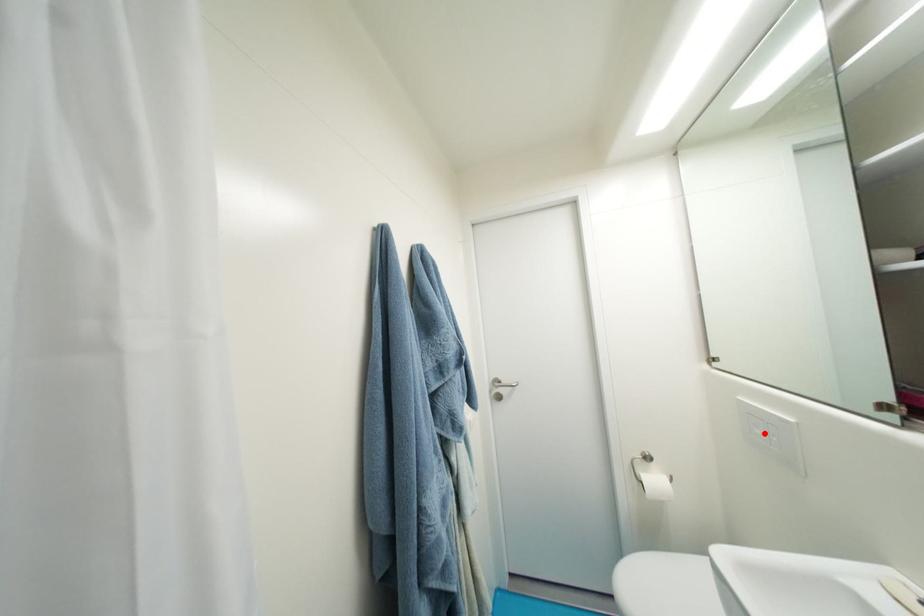
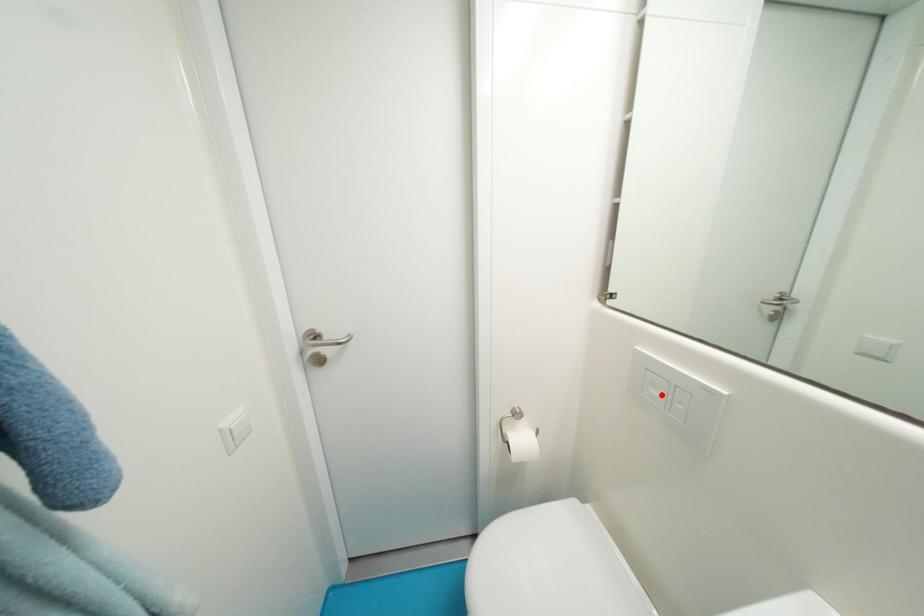
I am providing you with two images of the same scene from different viewpoints. A red point is marked on the first image and another point is marked on the second image. Is the marked point in image1 the same physical position as the marked point in image2?

Yes